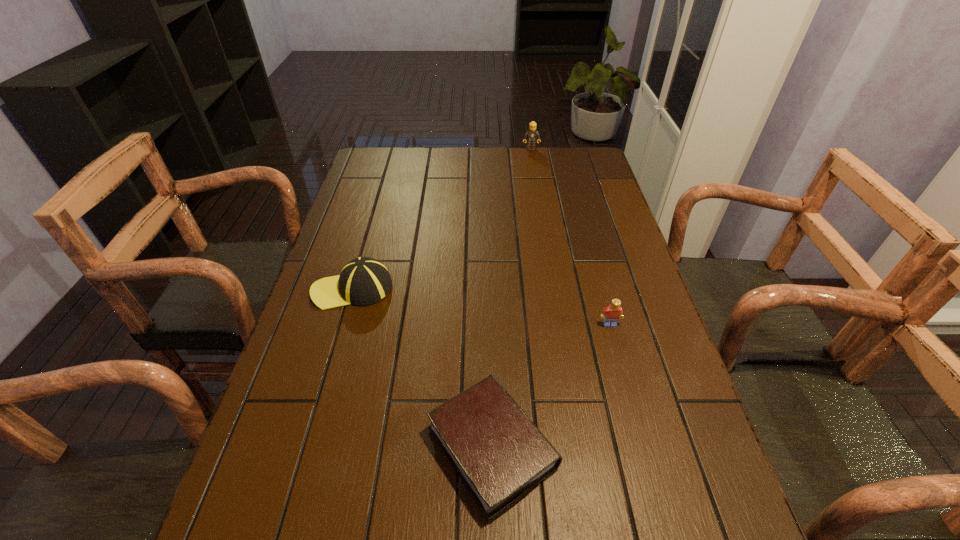
Identify the location of empty space that is in between the left Lego and the leftmost object. click(442, 219).

Locate an element on the screen. This screenshot has height=540, width=960. free space between the right Lego and the shortest object is located at coordinates (551, 386).

The image size is (960, 540). Find the location of `vacant space that's between the leftmost object and the right Lego`. vacant space that's between the leftmost object and the right Lego is located at coordinates (481, 307).

Where is `blank region between the rightmost object and the second object from left to right`? Image resolution: width=960 pixels, height=540 pixels. blank region between the rightmost object and the second object from left to right is located at coordinates (551, 386).

What are the coordinates of `free space between the baseball cap and the Bible` in the screenshot? It's located at (422, 368).

You are a GUI agent. You are given a task and a screenshot of the screen. Output one action in this format:
    pyautogui.click(x=<x>, y=<y>)
    Task: Click on the empty space that is in between the shorter Lego and the baseball cap
    This screenshot has width=960, height=540.
    Given the screenshot: What is the action you would take?
    pyautogui.click(x=481, y=307)

Identify the location of vacant region between the rightmost object and the farther Lego. Image resolution: width=960 pixels, height=540 pixels. (570, 237).

I want to click on object that is the second closest one to the rightmost object, so click(x=363, y=281).

Identify the location of object that is the third closest one to the nearer Lego. This screenshot has width=960, height=540. (531, 135).

Find the location of a particular element. This screenshot has height=540, width=960. vacant area that satisfies the following two spatial constraints: 1. with the brim of the shortest object facing forward; 2. on the right side of the baseball cap is located at coordinates (306, 448).